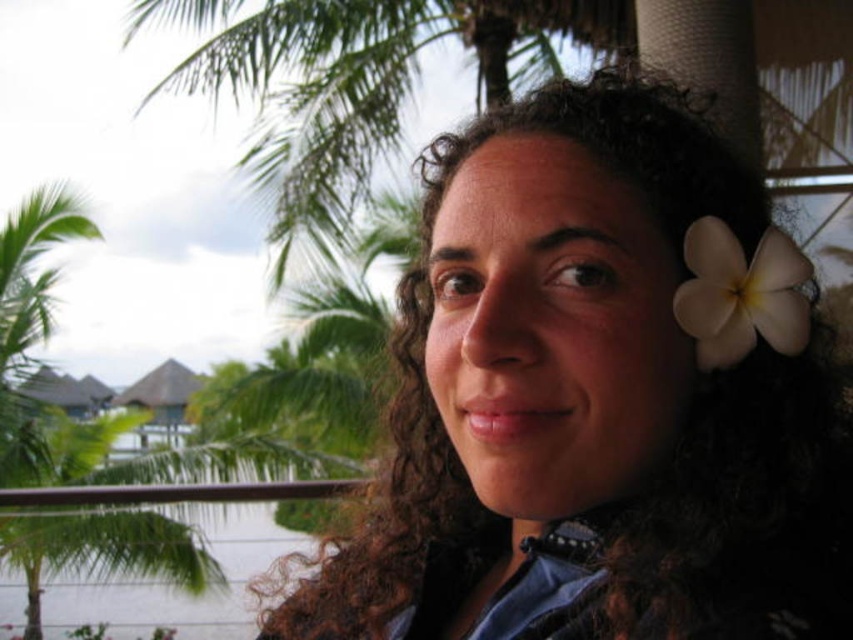
Between green leafy palm tree at upper left and white matte flower at upper right, which one is positioned higher?

white matte flower at upper right is higher up.

Between green leafy palm tree at upper left and white matte flower at upper right, which one appears on the left side from the viewer's perspective?

From the viewer's perspective, green leafy palm tree at upper left appears more on the left side.

Locate an element on the screen. The image size is (853, 640). green leafy palm tree at upper left is located at coordinates (48, 365).

Between point (550, 525) and point (693, 250), which one is positioned in front?

Point (693, 250)

Which of these two, matte black hair at center or white matte flower at upper right, stands shorter?

With less height is white matte flower at upper right.

Describe the element at coordinates (592, 403) in the screenshot. I see `matte black hair at center` at that location.

Locate an element on the screen. Image resolution: width=853 pixels, height=640 pixels. matte black hair at center is located at coordinates (592, 403).

Does point (514, 602) come behind point (27, 625)?

No, (514, 602) is in front of (27, 625).

Find the location of a particular element. This screenshot has width=853, height=640. matte black hair at center is located at coordinates (592, 403).